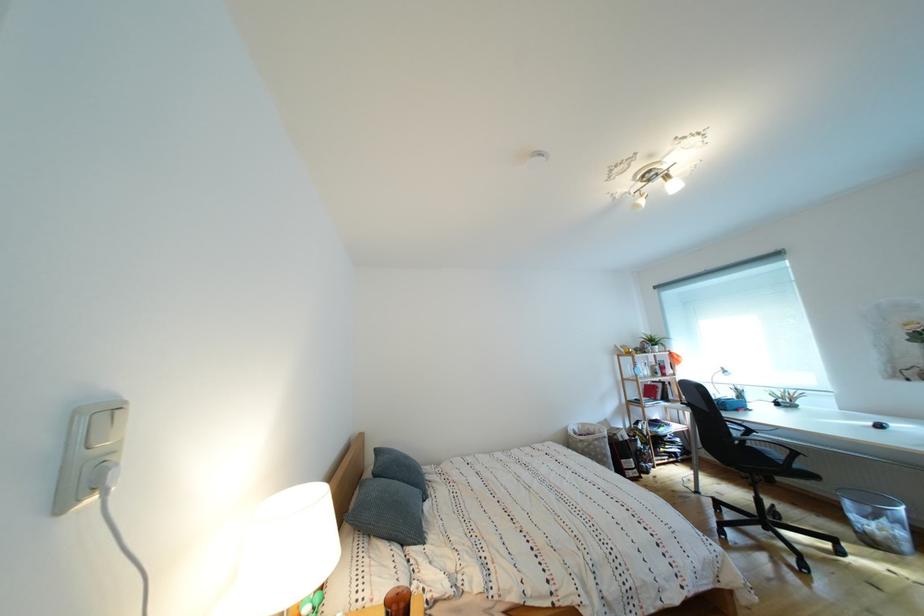
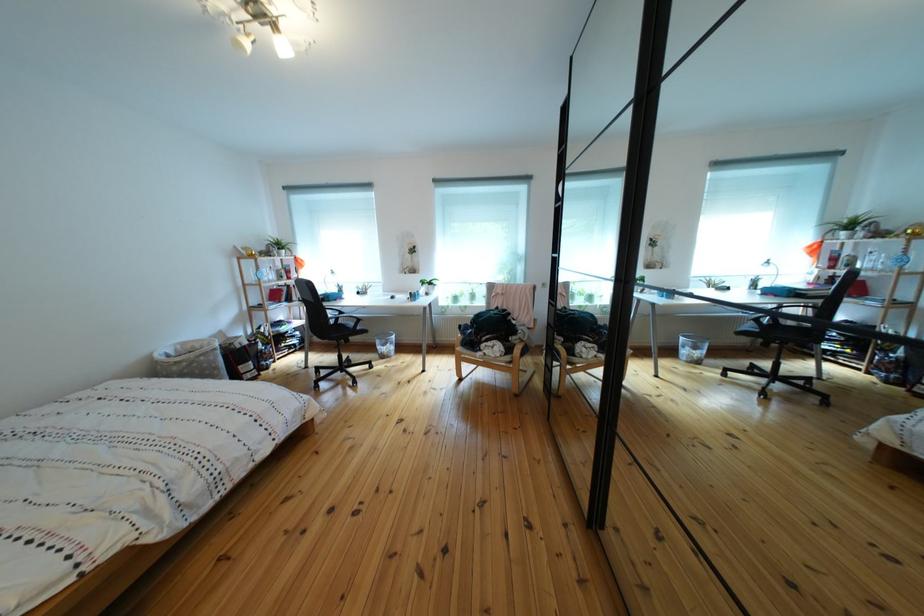
In the second image, find the point that corresponds to (x=655, y=182) in the first image.

(258, 10)